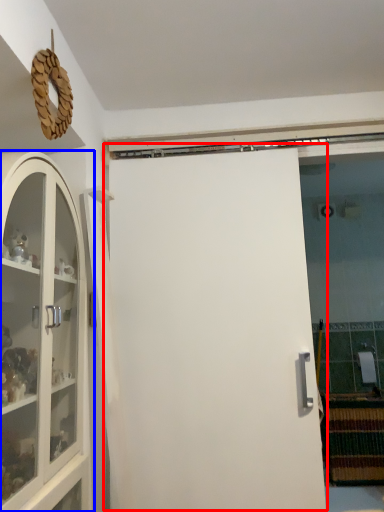
Question: Which object is further to the camera taking this photo, door (highlighted by a red box) or cabinetry (highlighted by a blue box)?

Choices:
 (A) door
 (B) cabinetry

Answer: (A)